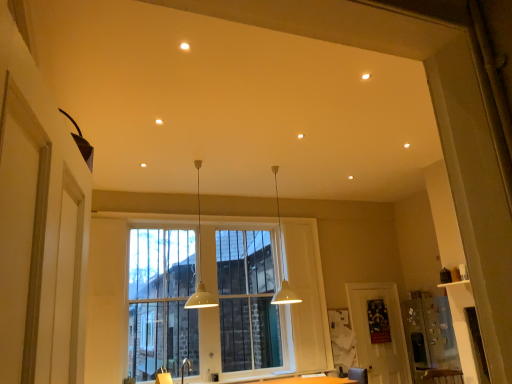
What do you see at coordinates (379, 333) in the screenshot? Image resolution: width=512 pixels, height=384 pixels. I see `matte white screen door at lower right` at bounding box center [379, 333].

Find the location of `white matte pendant light at center, the 2th lamp in the right-to-left sequence`. white matte pendant light at center, the 2th lamp in the right-to-left sequence is located at coordinates (200, 262).

Identify the location of matte white screen door at lower right. pyautogui.click(x=379, y=333).

From the image's perspective, which one is positioned higher, white matte pendant light at center, positioned as the first lamp in right-to-left order, or clear glass window at center?

white matte pendant light at center, positioned as the first lamp in right-to-left order, appears higher in the image.

Looking at this image, is white matte pendant light at center, positioned as the first lamp in right-to-left order, oriented towards clear glass window at center?

No.

From a real-world perspective, is white matte pendant light at center, the 2th lamp when ordered from left to right, located beneath clear glass window at center?

No, from a real-world perspective, white matte pendant light at center, the 2th lamp when ordered from left to right, is not under clear glass window at center.

Is white matte pendant light at center, positioned as the first lamp in right-to-left order, far away from clear glass window at center?

white matte pendant light at center, positioned as the first lamp in right-to-left order, is near clear glass window at center, not far away.

Is white matte pendant light at center, the first lamp positioned from the left, closer to camera compared to white matte pendant light at center, the 2th lamp when ordered from left to right?

Yes, the depth of white matte pendant light at center, the first lamp positioned from the left, is less than that of white matte pendant light at center, the 2th lamp when ordered from left to right.

Is point (200, 234) positioned behind point (278, 208)?

No, (200, 234) is closer to viewer.

From the image's perspective, which one is positioned lower, white matte pendant light at center, the 2th lamp in the right-to-left sequence, or white matte pendant light at center, positioned as the first lamp in right-to-left order?

white matte pendant light at center, positioned as the first lamp in right-to-left order, from the image's perspective.

Who is smaller, matte white screen door at lower right or white matte pendant light at center, the first lamp positioned from the left?

With smaller size is matte white screen door at lower right.

I want to click on the 1st lamp positioned above the matte white screen door at lower right (from a real-world perspective), so click(x=200, y=262).

Which is farther from the camera, (396, 357) or (201, 304)?

The point (396, 357) is farther.

Considering the sizes of objects matte white screen door at lower right and white matte pendant light at center, the first lamp positioned from the left, in the image provided, who is wider, matte white screen door at lower right or white matte pendant light at center, the first lamp positioned from the left,?

Wider between the two is white matte pendant light at center, the first lamp positioned from the left.

Can you confirm if matte white screen door at lower right is smaller than clear glass window at center?

Indeed, matte white screen door at lower right has a smaller size compared to clear glass window at center.

Is matte white screen door at lower right facing away from clear glass window at center?

No, matte white screen door at lower right is not facing away from clear glass window at center.

Which point is more distant from viewer, (x=390, y=315) or (x=189, y=278)?

Point (x=390, y=315)

Based on the photo, are matte white screen door at lower right and clear glass window at center making contact?

No, matte white screen door at lower right is not in contact with clear glass window at center.

From the picture: Is clear glass window at center facing towards white matte pendant light at center, positioned as the first lamp in right-to-left order?

Yes, clear glass window at center is facing white matte pendant light at center, positioned as the first lamp in right-to-left order.

Is clear glass window at center positioned in front of white matte pendant light at center, the 2th lamp when ordered from left to right?

No, the depth of clear glass window at center is greater than that of white matte pendant light at center, the 2th lamp when ordered from left to right.

Based on the photo, from a real-world perspective, is clear glass window at center physically located above or below white matte pendant light at center, positioned as the first lamp in right-to-left order?

clear glass window at center is situated lower than white matte pendant light at center, positioned as the first lamp in right-to-left order, in the real world.

Considering the relative sizes of clear glass window at center and white matte pendant light at center, positioned as the first lamp in right-to-left order, in the image provided, is clear glass window at center thinner than white matte pendant light at center, positioned as the first lamp in right-to-left order,?

Yes, clear glass window at center is thinner than white matte pendant light at center, positioned as the first lamp in right-to-left order.

Based on their sizes in the image, would you say white matte pendant light at center, the 2th lamp in the right-to-left sequence, is bigger or smaller than matte white screen door at lower right?

white matte pendant light at center, the 2th lamp in the right-to-left sequence, is bigger than matte white screen door at lower right.

Could you tell me if white matte pendant light at center, the 2th lamp in the right-to-left sequence, is facing matte white screen door at lower right?

No, white matte pendant light at center, the 2th lamp in the right-to-left sequence, is not turned towards matte white screen door at lower right.

Is white matte pendant light at center, the 2th lamp in the right-to-left sequence, far away from matte white screen door at lower right?

Yes, white matte pendant light at center, the 2th lamp in the right-to-left sequence, is far from matte white screen door at lower right.

Does white matte pendant light at center, the first lamp positioned from the left, have a lesser width compared to matte white screen door at lower right?

No, white matte pendant light at center, the first lamp positioned from the left, is not thinner than matte white screen door at lower right.

The width and height of the screenshot is (512, 384). Identify the location of lamp below the white matte pendant light at center, the 2th lamp when ordered from left to right (from a real-world perspective). click(x=200, y=262).

Who is smaller, white matte pendant light at center, the 2th lamp when ordered from left to right, or white matte pendant light at center, the first lamp positioned from the left?

white matte pendant light at center, the first lamp positioned from the left.

Is point (278, 303) closer or farther from the camera than point (200, 162)?

Point (278, 303).

From a real-world perspective, is white matte pendant light at center, positioned as the first lamp in right-to-left order, physically located above or below white matte pendant light at center, the 2th lamp in the right-to-left sequence?

From a real-world perspective, white matte pendant light at center, positioned as the first lamp in right-to-left order, is physically above white matte pendant light at center, the 2th lamp in the right-to-left sequence.

Which lamp is the 1st one when counting from the front of the clear glass window at center? Please provide its 2D coordinates.

[(282, 260)]

What are the coordinates of `lamp behind the white matte pendant light at center, the first lamp positioned from the left` in the screenshot? It's located at (282, 260).

Looking at the image, which one is located further to matte white screen door at lower right, white matte pendant light at center, the 2th lamp in the right-to-left sequence, or clear glass window at center?

Among the two, white matte pendant light at center, the 2th lamp in the right-to-left sequence, is located further to matte white screen door at lower right.

When comparing their distances from white matte pendant light at center, the 2th lamp when ordered from left to right, does white matte pendant light at center, the 2th lamp in the right-to-left sequence, or clear glass window at center seem closer?

clear glass window at center is positioned closer to the anchor white matte pendant light at center, the 2th lamp when ordered from left to right.

Which object lies further to the anchor point white matte pendant light at center, the first lamp positioned from the left, matte white screen door at lower right or white matte pendant light at center, the 2th lamp when ordered from left to right?

Based on the image, matte white screen door at lower right appears to be further to white matte pendant light at center, the first lamp positioned from the left.

Which object lies further to the anchor point matte white screen door at lower right, clear glass window at center or white matte pendant light at center, positioned as the first lamp in right-to-left order?

clear glass window at center is further to matte white screen door at lower right.

In the scene shown: Looking at the image, which one is located closer to clear glass window at center, matte white screen door at lower right or white matte pendant light at center, the first lamp positioned from the left?

Among the two, white matte pendant light at center, the first lamp positioned from the left, is located nearer to clear glass window at center.

Which object lies nearer to the anchor point white matte pendant light at center, the 2th lamp when ordered from left to right, clear glass window at center or matte white screen door at lower right?

Based on the image, clear glass window at center appears to be nearer to white matte pendant light at center, the 2th lamp when ordered from left to right.

Estimate the real-world distances between objects in this image. Which object is further from white matte pendant light at center, positioned as the first lamp in right-to-left order, matte white screen door at lower right or clear glass window at center?

matte white screen door at lower right is further to white matte pendant light at center, positioned as the first lamp in right-to-left order.

Looking at the image, which one is located closer to matte white screen door at lower right, white matte pendant light at center, positioned as the first lamp in right-to-left order, or clear glass window at center?

white matte pendant light at center, positioned as the first lamp in right-to-left order, lies closer to matte white screen door at lower right than the other object.

I want to click on lamp situated between white matte pendant light at center, the 2th lamp in the right-to-left sequence, and matte white screen door at lower right from left to right, so point(282,260).

Locate an element on the screen. This screenshot has height=384, width=512. lamp between white matte pendant light at center, the first lamp positioned from the left, and clear glass window at center vertically is located at coordinates (282, 260).